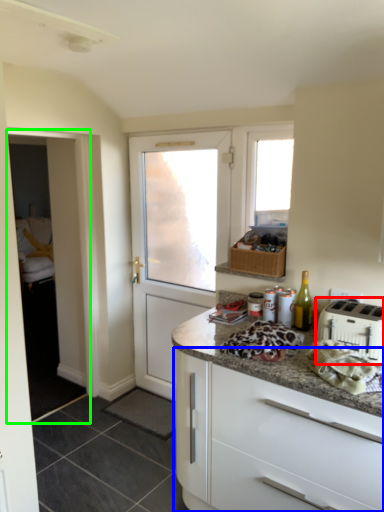
Question: Based on their relative distances, which object is farther from toaster (highlighted by a red box)? Choose from cabinetry (highlighted by a blue box) and screen door (highlighted by a green box).

Choices:
 (A) cabinetry
 (B) screen door

Answer: (B)